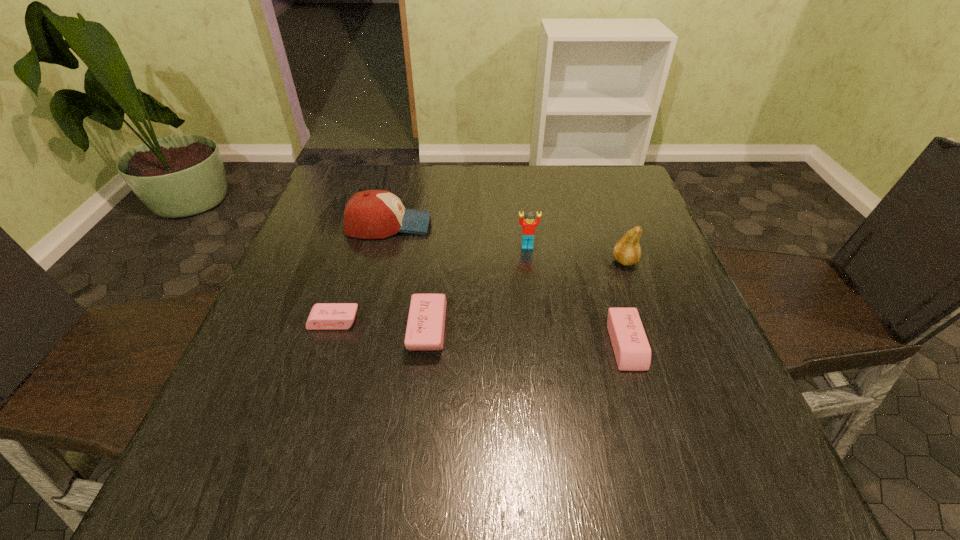
Find the location of a particular element. The height and width of the screenshot is (540, 960). pear located in the right edge section of the desktop is located at coordinates pyautogui.click(x=627, y=251).

At what (x,y) coordinates should I click in order to perform the action: click on object that is positioned at the far left corner. Please return your answer as a coordinate pair (x, y). Looking at the image, I should click on (372, 214).

Image resolution: width=960 pixels, height=540 pixels. What are the coordinates of `vacant region at the far edge of the desktop` in the screenshot? It's located at (489, 177).

Locate an element on the screen. The image size is (960, 540). free space at the near edge of the desktop is located at coordinates (352, 415).

Find the location of a particular element. free space at the left edge is located at coordinates (319, 252).

Identify the location of vacant region at the far left corner of the desktop. The width and height of the screenshot is (960, 540). pyautogui.click(x=382, y=174).

This screenshot has height=540, width=960. What are the coordinates of `blank space at the far right corner of the desktop` in the screenshot? It's located at [622, 178].

In the image, there is a desktop. In order to click on free region at the near right corner in this screenshot , I will do `click(670, 404)`.

Where is `free space between the second shortest object and the baseball cap`? free space between the second shortest object and the baseball cap is located at coordinates (507, 285).

The image size is (960, 540). I want to click on free space between the fourth object from left to right and the shortest eraser, so click(430, 284).